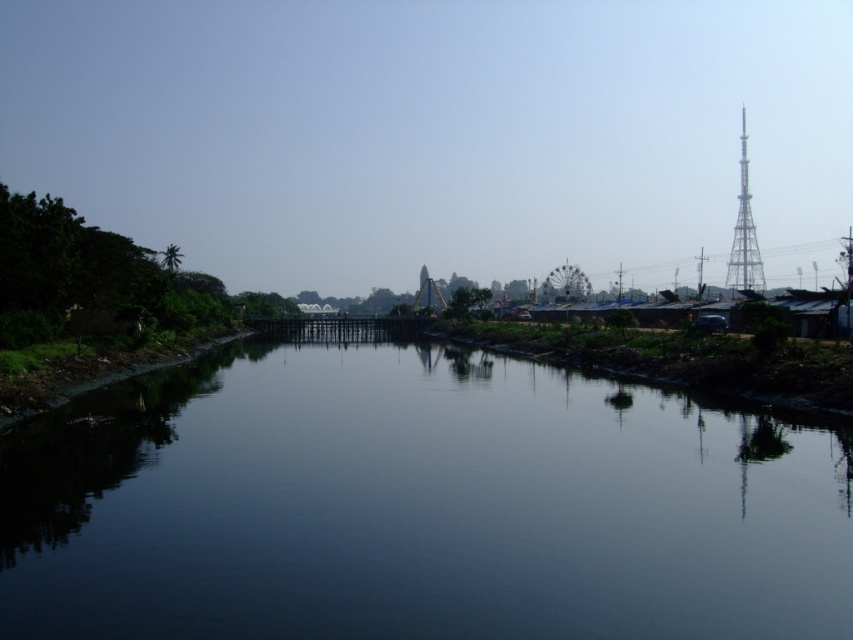
Does dark water at center have a greater height compared to metallic tower at right?

No, dark water at center is not taller than metallic tower at right.

Between point (822, 486) and point (741, 180), which one is positioned in front?

Point (822, 486) is more forward.

Between point (607, 548) and point (740, 193), which one is positioned in front?

Point (607, 548)

Find the location of `dark water at center`. dark water at center is located at coordinates (418, 504).